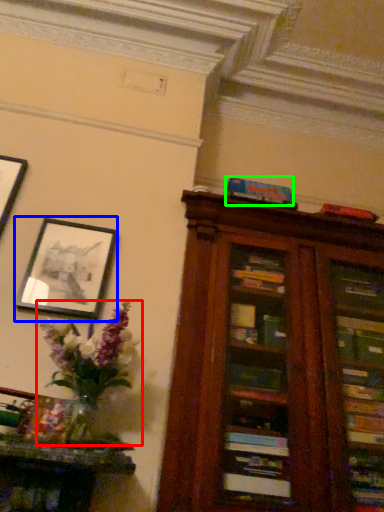
Question: Which object is the closest to the floral arrangement (highlighted by a red box)? Choose among these: picture frame (highlighted by a blue box) or paperback book (highlighted by a green box).

Choices:
 (A) picture frame
 (B) paperback book

Answer: (A)